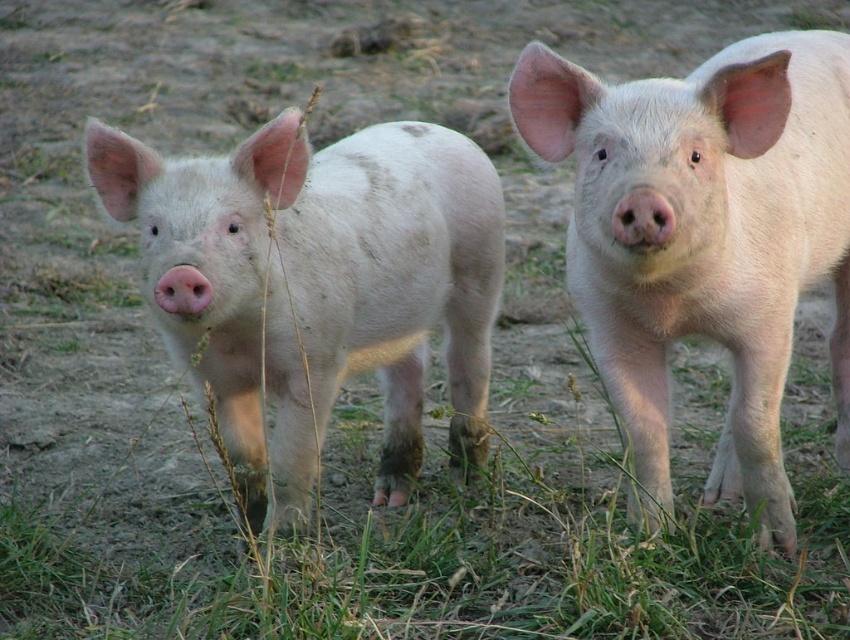
You are a photographer trying to capture the matte white piglet at center in your shot. Based on its 2D coordinates, where should you position your camera to ensure it is centered in the frame?

The matte white piglet at center is located at coordinates (318, 284). To center it in the frame, position your camera so that the crosshairs align with these coordinates, ensuring the piglet is at the center of your viewfinder.

You are standing at the origin point in the image, which is the bottom left corner. You want to walk towards the point labeled as point (318, 284). What will you encounter when you arrive at that point?

When you arrive at point (318, 284), you will encounter the matte white piglet at center.